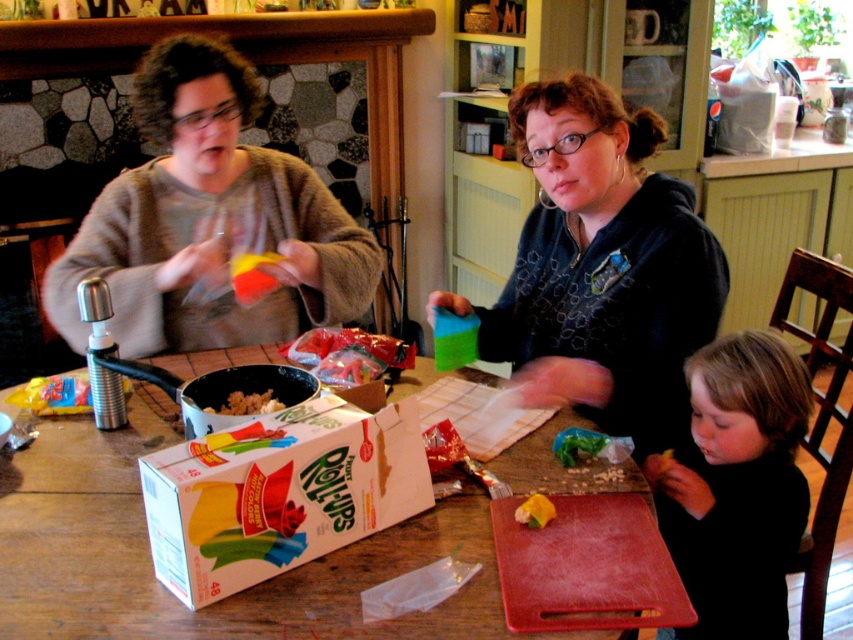
Is black soft shirt at lower right to the right of yellow plastic toy at lower center from the viewer's perspective?

Indeed, black soft shirt at lower right is positioned on the right side of yellow plastic toy at lower center.

Who is positioned more to the right, black soft shirt at lower right or yellow plastic toy at lower center?

Positioned to the right is black soft shirt at lower right.

Which is behind, point (763, 499) or point (526, 513)?

The point (763, 499) is more distant.

Identify the location of black soft shirt at lower right. The image size is (853, 640). (737, 486).

Does matte gray sweater at left have a greater height compared to white cardboard box at center?

Correct, matte gray sweater at left is much taller as white cardboard box at center.

Between point (215, 173) and point (181, 515), which one is positioned in front?

Point (181, 515)

Is point (265, 240) positioned in front of point (236, 500)?

No, it is not.

Locate an element on the screen. The height and width of the screenshot is (640, 853). matte gray sweater at left is located at coordinates (209, 221).

Between wooden table at center and white cardboard box at center, which one appears on the left side from the viewer's perspective?

wooden table at center

Is wooden table at center further to the viewer compared to white cardboard box at center?

That is False.

Which is in front, point (431, 621) or point (206, 584)?

Point (431, 621) is more forward.

In order to click on wooden table at center in this screenshot , I will do `click(225, 596)`.